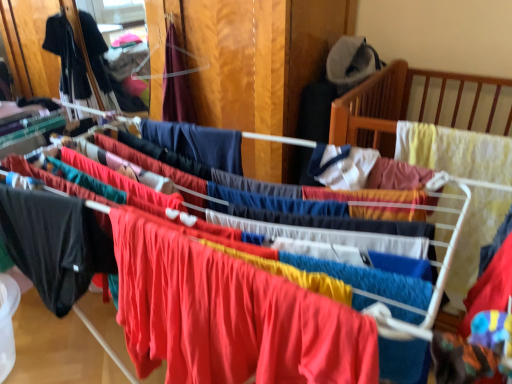
Question: In terms of width, does black matte pants at left, the 3th clothing from the right, look wider or thinner when compared to matte red fabric at center, the 1th clothing in the right-to-left sequence?

Choices:
 (A) thin
 (B) wide

Answer: (A)

Question: From a real-world perspective, is black matte pants at left, the 3th clothing from the right, above or below matte red fabric at center, the 1th clothing viewed from the front?

Choices:
 (A) below
 (B) above

Answer: (B)

Question: Which is farther from the black fabric shirt at left, which is counted as the first clothing, starting from the back?

Choices:
 (A) matte red fabric at center, the 1th clothing viewed from the front
 (B) velvet burgundy dress at upper center, which is counted as the third clothing, starting from the left
 (C) black matte pants at left, the 2th clothing viewed from the left

Answer: (A)

Question: Based on their relative distances, which object is farther from the matte red fabric at center, which is counted as the fourth clothing, starting from the left?

Choices:
 (A) black matte pants at left, the 2th clothing viewed from the left
 (B) velvet burgundy dress at upper center, the 2th clothing viewed from the back
 (C) black fabric shirt at left, the fourth clothing in the front-to-back sequence

Answer: (C)